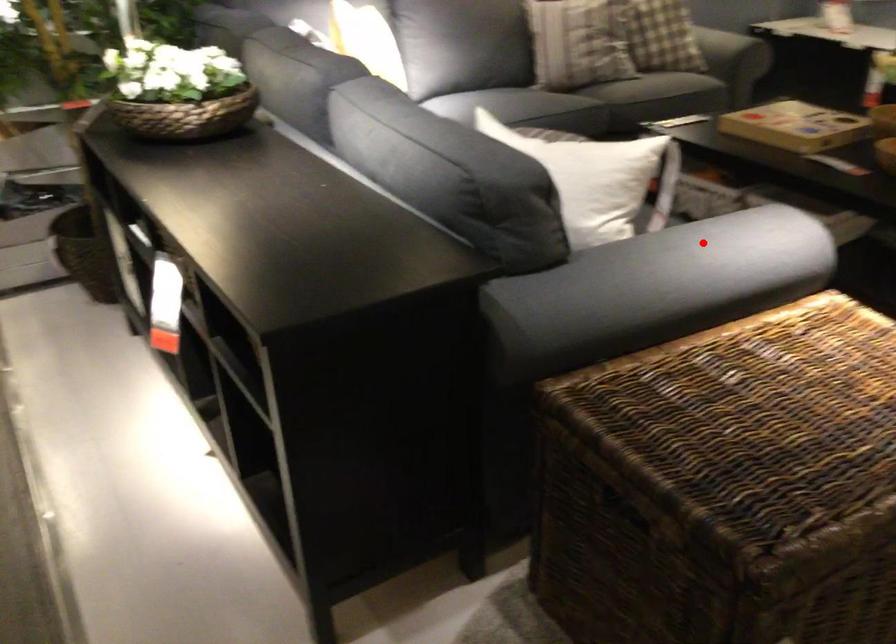
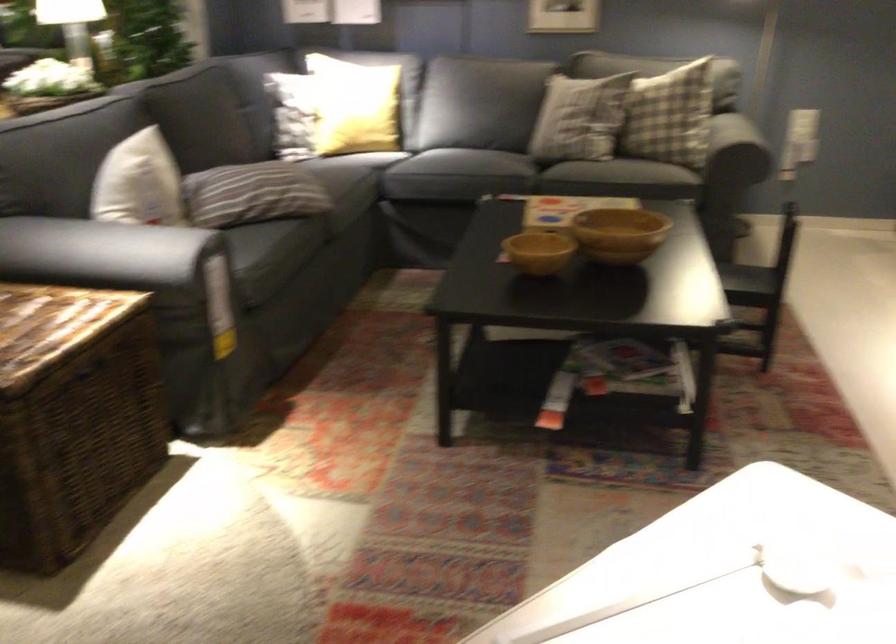
Question: I am providing you with two images of the same scene from different viewpoints. A red point is shown in image1. For the corresponding object point in image2, is it positioned nearer or farther from the camera?

Choices:
 (A) Nearer
 (B) Farther

Answer: (B)